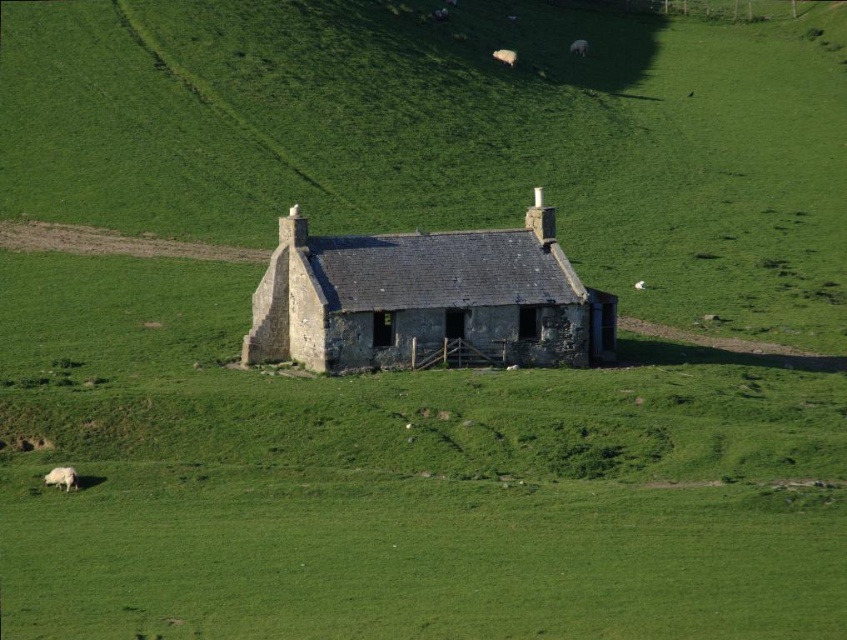
Question: Is stone slate roof cottage at center below white woolly sheep at lower left?

Choices:
 (A) no
 (B) yes

Answer: (A)

Question: Estimate the real-world distances between objects in this image. Which object is farther from the white woolly sheep at center?

Choices:
 (A) white woolly sheep at lower left
 (B) white woolly sheep at upper center
 (C) stone slate roof cottage at center

Answer: (A)

Question: Can you confirm if stone slate roof cottage at center is positioned above white woolly sheep at lower left?

Choices:
 (A) yes
 (B) no

Answer: (A)

Question: Which point is closer to the camera?

Choices:
 (A) (574, 38)
 (B) (54, 472)

Answer: (B)

Question: Which of the following is the farthest from the observer?

Choices:
 (A) (508, 58)
 (B) (328, 252)
 (C) (574, 45)

Answer: (C)

Question: Is stone slate roof cottage at center bigger than white woolly sheep at center?

Choices:
 (A) yes
 (B) no

Answer: (A)